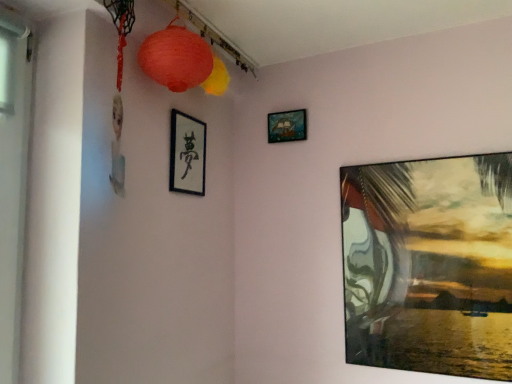
Question: Considering the relative sizes of matte glass painting at right, arranged as the first picture frame when viewed from the right, and black matte picture frame at upper center, the first picture frame viewed from the left, in the image provided, is matte glass painting at right, arranged as the first picture frame when viewed from the right, thinner than black matte picture frame at upper center, the first picture frame viewed from the left,?

Choices:
 (A) yes
 (B) no

Answer: (B)

Question: Can you confirm if matte glass painting at right, the first picture frame in the bottom-to-top sequence, is bigger than black matte picture frame at upper center, which ranks as the 2th picture frame in top-to-bottom order?

Choices:
 (A) no
 (B) yes

Answer: (B)

Question: From the image's perspective, is matte glass painting at right, the first picture frame in the bottom-to-top sequence, above black matte picture frame at upper center, which ranks as the 2th picture frame in top-to-bottom order?

Choices:
 (A) no
 (B) yes

Answer: (A)

Question: Could you tell me if matte glass painting at right, the first picture frame in the bottom-to-top sequence, is turned towards black matte picture frame at upper center, which appears as the 2th picture frame when ordered from the bottom?

Choices:
 (A) no
 (B) yes

Answer: (A)

Question: Considering the relative sizes of matte glass painting at right, the third picture frame in the left-to-right sequence, and black matte picture frame at upper center, the first picture frame viewed from the left, in the image provided, is matte glass painting at right, the third picture frame in the left-to-right sequence, shorter than black matte picture frame at upper center, the first picture frame viewed from the left,?

Choices:
 (A) no
 (B) yes

Answer: (A)

Question: Is matte glass painting at right, the first picture frame in the bottom-to-top sequence, further to camera compared to black matte picture frame at upper center, which ranks as the 2th picture frame in top-to-bottom order?

Choices:
 (A) yes
 (B) no

Answer: (B)

Question: Is the position of matte paper lantern at upper center, positioned as the first lantern in front-to-back order, more distant than that of matte paper lantern at upper center, arranged as the 1th lantern when viewed from the back?

Choices:
 (A) no
 (B) yes

Answer: (A)

Question: From a real-world perspective, is matte paper lantern at upper center, which is the 2th lantern in back-to-front order, positioned under matte paper lantern at upper center, the second lantern positioned from the front, based on gravity?

Choices:
 (A) yes
 (B) no

Answer: (A)

Question: Is matte paper lantern at upper center, which is the 2th lantern in back-to-front order, shorter than matte paper lantern at upper center, the second lantern positioned from the front?

Choices:
 (A) yes
 (B) no

Answer: (B)

Question: From a real-world perspective, is matte paper lantern at upper center, positioned as the first lantern in front-to-back order, positioned over matte paper lantern at upper center, arranged as the 1th lantern when viewed from the back, based on gravity?

Choices:
 (A) yes
 (B) no

Answer: (B)

Question: Can you confirm if matte paper lantern at upper center, which is the 2th lantern in back-to-front order, is bigger than matte paper lantern at upper center, arranged as the 1th lantern when viewed from the back?

Choices:
 (A) yes
 (B) no

Answer: (A)

Question: Is matte paper lantern at upper center, which is the 2th lantern in back-to-front order, at the left side of matte paper lantern at upper center, the second lantern positioned from the front?

Choices:
 (A) yes
 (B) no

Answer: (A)

Question: Would you say matte paper lantern at upper center, which is the 2th lantern in back-to-front order, contains wooden ship at upper center, the 1th picture frame positioned from the top?

Choices:
 (A) yes
 (B) no

Answer: (B)